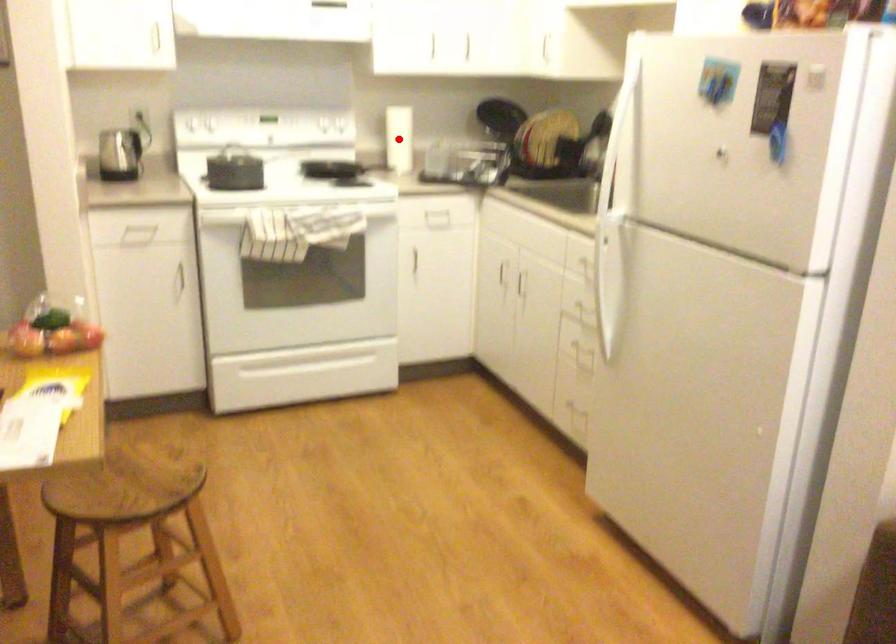
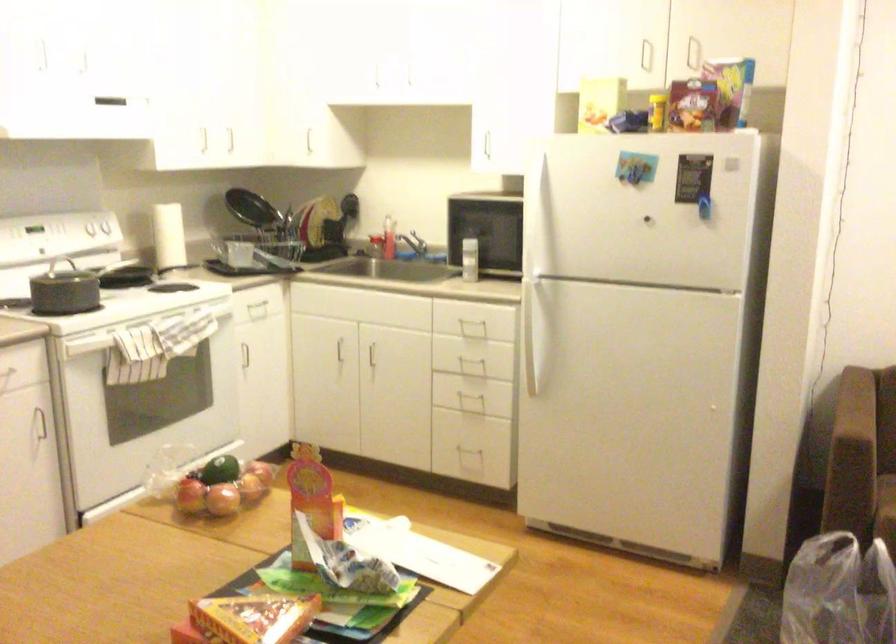
Question: I am providing you with two images of the same scene from different viewpoints. A red point is marked on the first image. Is the red point's position out of view in image 2?

Choices:
 (A) Yes
 (B) No

Answer: (A)